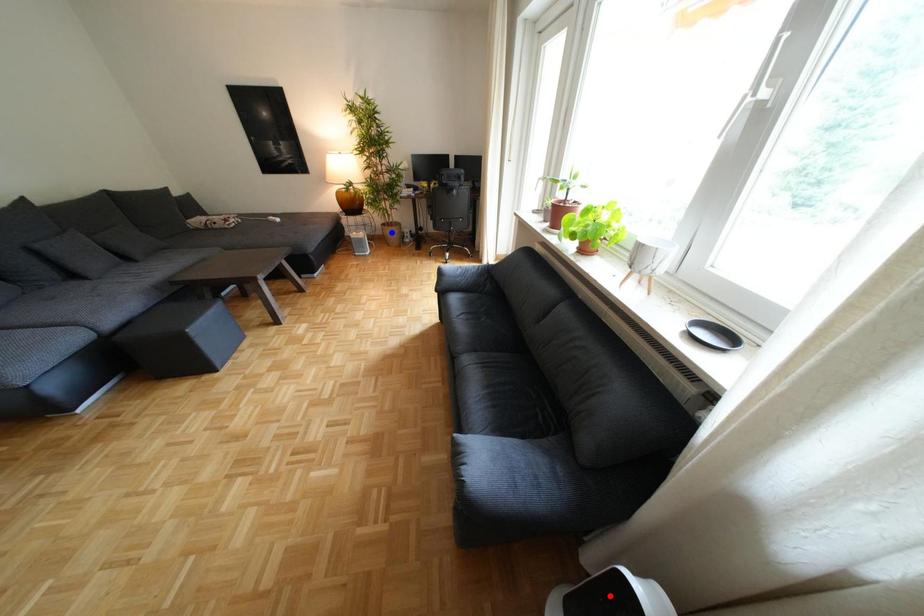
Question: Which of the two points in the image is closer to the camera?

Choices:
 (A) Blue point is closer.
 (B) Red point is closer.

Answer: (B)